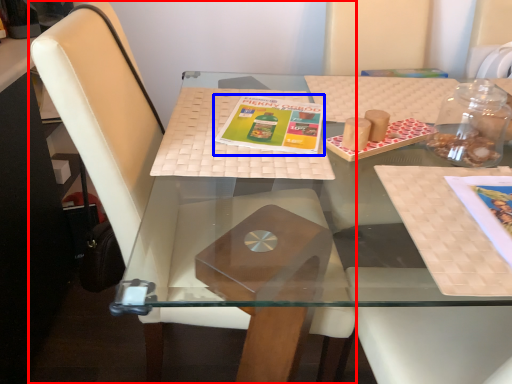
Question: Which object is closer to the camera taking this photo, chair (highlighted by a red box) or book cover (highlighted by a blue box)?

Choices:
 (A) chair
 (B) book cover

Answer: (A)